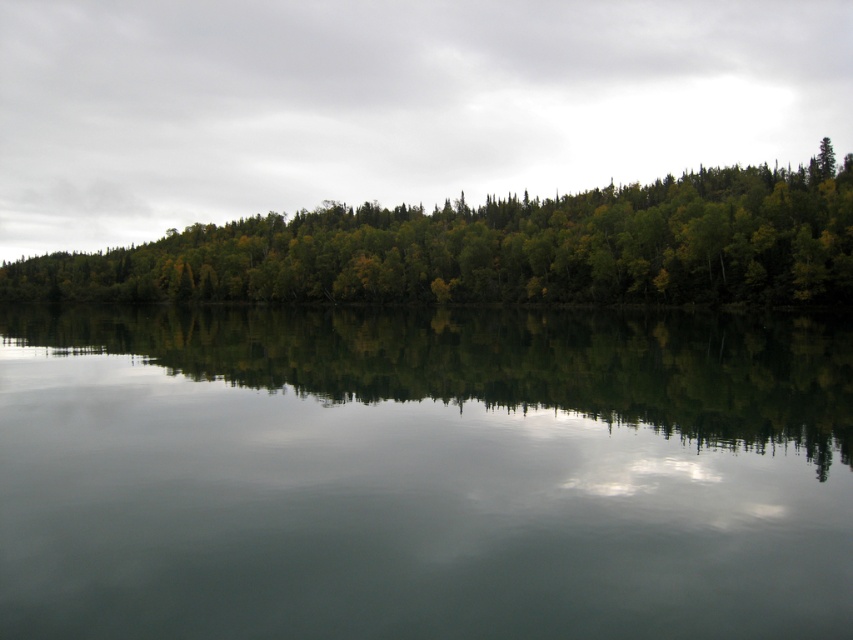
Question: Does green reflective water at center lie behind green leafy trees at center?

Choices:
 (A) no
 (B) yes

Answer: (A)

Question: Is green reflective water at center below green leafy trees at center?

Choices:
 (A) yes
 (B) no

Answer: (A)

Question: Among these objects, which one is nearest to the camera?

Choices:
 (A) green reflective water at center
 (B) green leafy trees at center

Answer: (A)

Question: Which object is closer to the camera taking this photo?

Choices:
 (A) green leafy trees at center
 (B) green reflective water at center

Answer: (B)

Question: Can you confirm if green reflective water at center is positioned below green leafy trees at center?

Choices:
 (A) no
 (B) yes

Answer: (B)